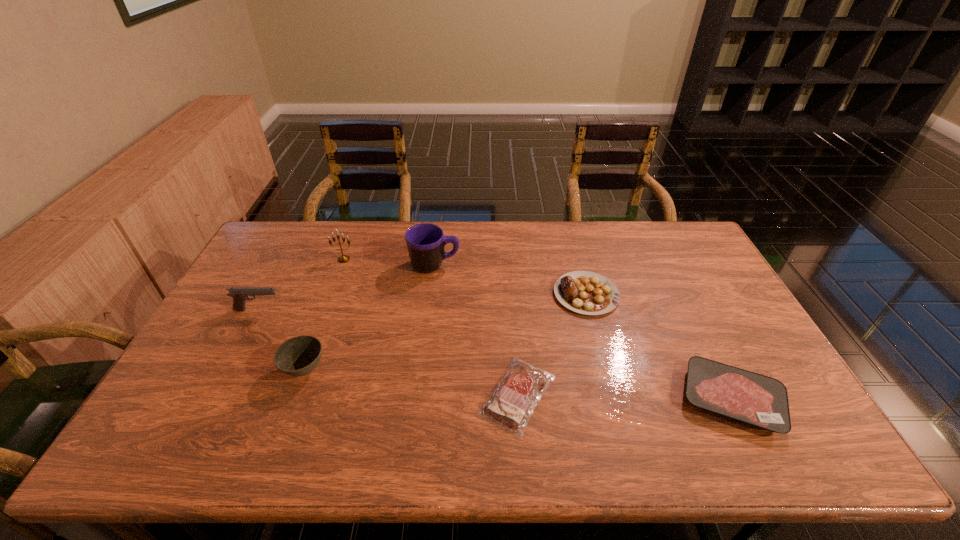
Identify the location of mug. (425, 242).

Locate an element on the screen. candelabrum is located at coordinates pos(344,258).

This screenshot has height=540, width=960. I want to click on pistol, so click(x=239, y=294).

In order to click on the leftmost object in this screenshot , I will do `click(239, 294)`.

This screenshot has width=960, height=540. In order to click on bowl in this screenshot , I will do (298, 356).

The height and width of the screenshot is (540, 960). Identify the location of the farthest steak. (584, 292).

At what (x,y) coordinates should I click in order to perform the action: click on the tallest steak. Please return your answer as a coordinate pair (x, y). This screenshot has width=960, height=540. Looking at the image, I should click on (584, 292).

At what (x,y) coordinates should I click in order to perform the action: click on the rightmost object. Please return your answer as a coordinate pair (x, y). This screenshot has height=540, width=960. Looking at the image, I should click on click(761, 401).

The image size is (960, 540). Identify the location of the sixth tallest object. (761, 401).

Locate an element on the screen. the leftmost steak is located at coordinates (510, 406).